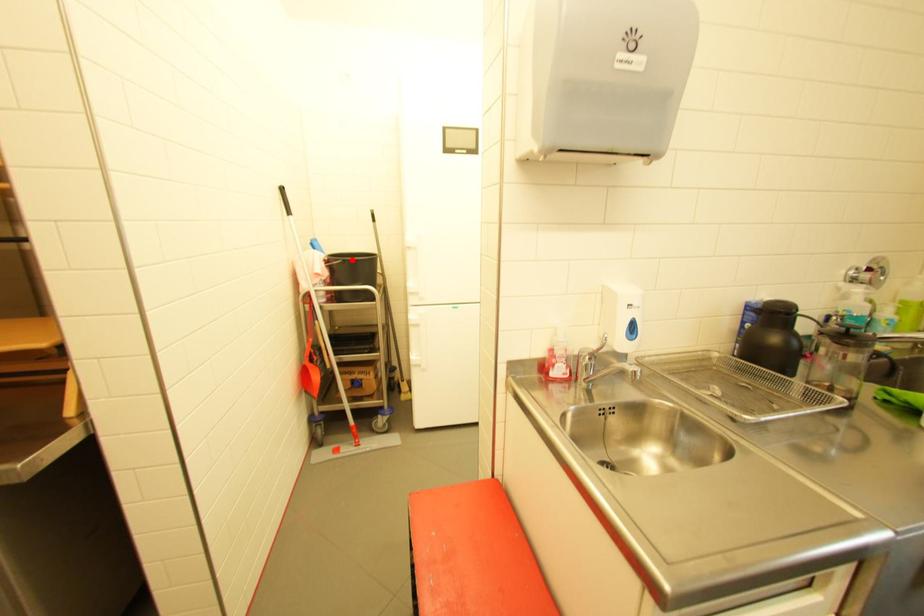
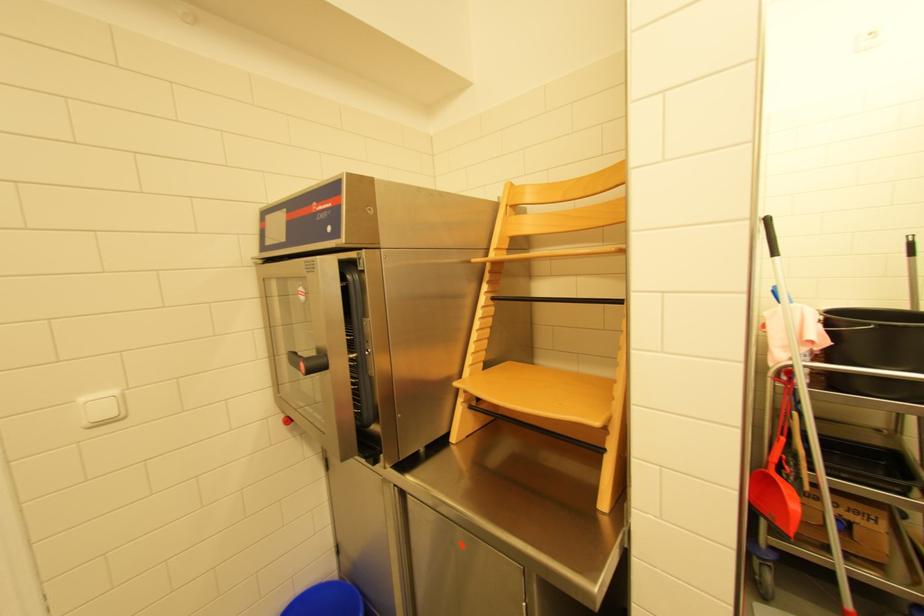
Where in the second image is the point corresponding to the highlighted location from the first image?

(890, 326)